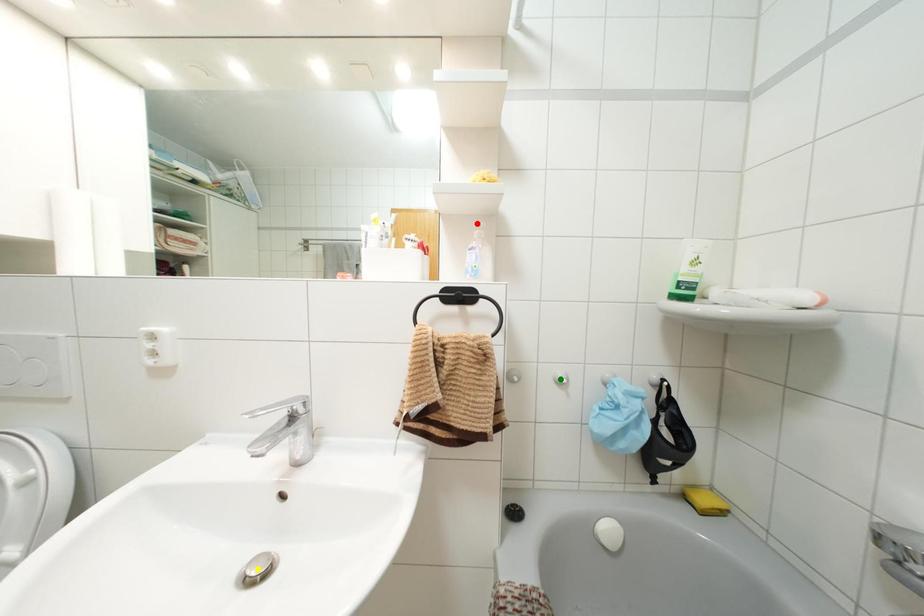
Order these from nearest to farthest:
1. green point
2. yellow point
3. red point

yellow point < red point < green point